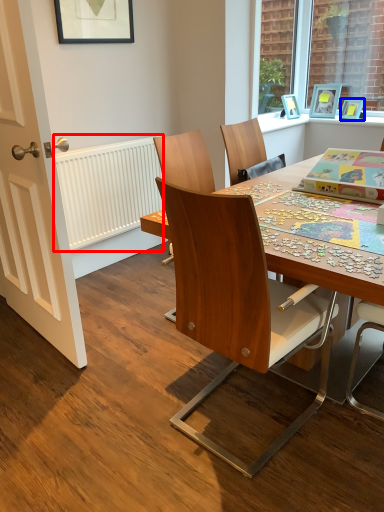
Question: Which object is closer to the camera taking this photo, radiator (highlighted by a red box) or picture frame (highlighted by a blue box)?

Choices:
 (A) radiator
 (B) picture frame

Answer: (A)